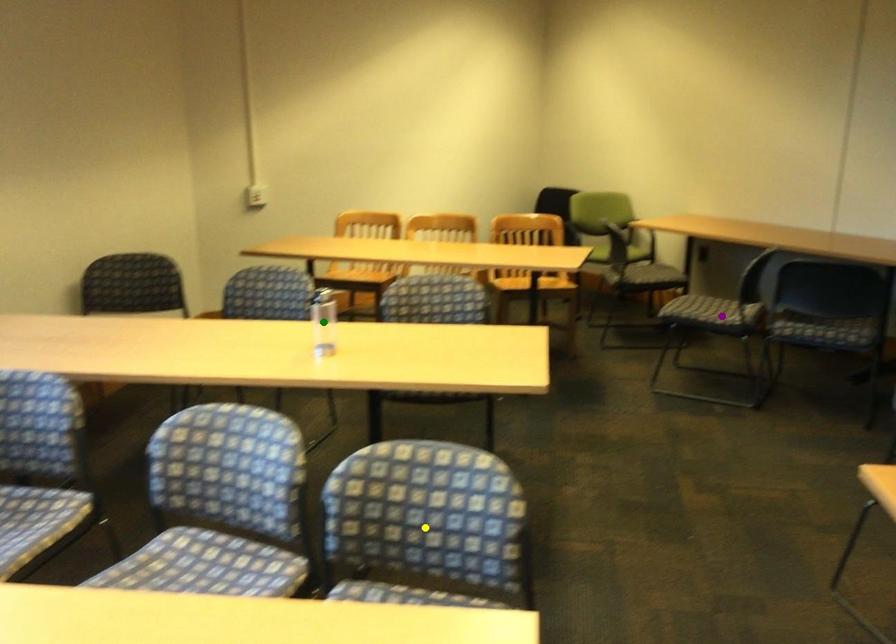
Order these from nearest to farthest:
purple point | green point | yellow point

green point < purple point < yellow point